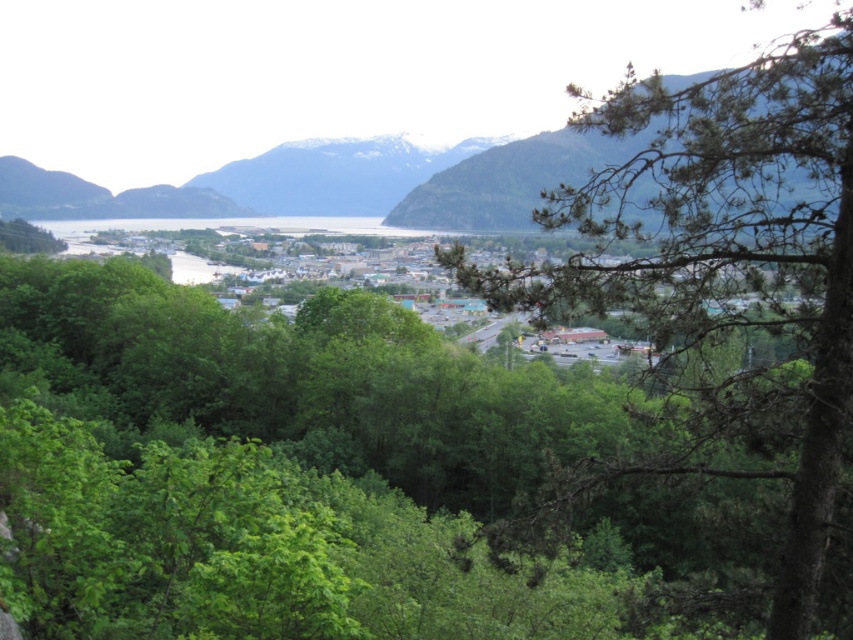
Question: Which point is farther to the camera?

Choices:
 (A) green leafy tree at center
 (B) green textured mountain at upper center
 (C) snowy rock mountain at center

Answer: (C)

Question: In this image, where is green leafy tree at center located relative to green textured mountain at upper center?

Choices:
 (A) left
 (B) right

Answer: (A)

Question: Which point is closer to the camera?

Choices:
 (A) snowy rock mountain at center
 (B) green textured mountain at upper center
 (C) green leafy tree at center

Answer: (C)

Question: Can you confirm if green textured mountain at upper center is smaller than snowy rock mountain at center?

Choices:
 (A) yes
 (B) no

Answer: (B)

Question: Can you confirm if green leafy tree at center is smaller than snowy rock mountain at center?

Choices:
 (A) no
 (B) yes

Answer: (B)

Question: Which point is closer to the camera?

Choices:
 (A) green textured mountain at upper center
 (B) snowy rock mountain at center
 (C) green leafy tree at center

Answer: (C)